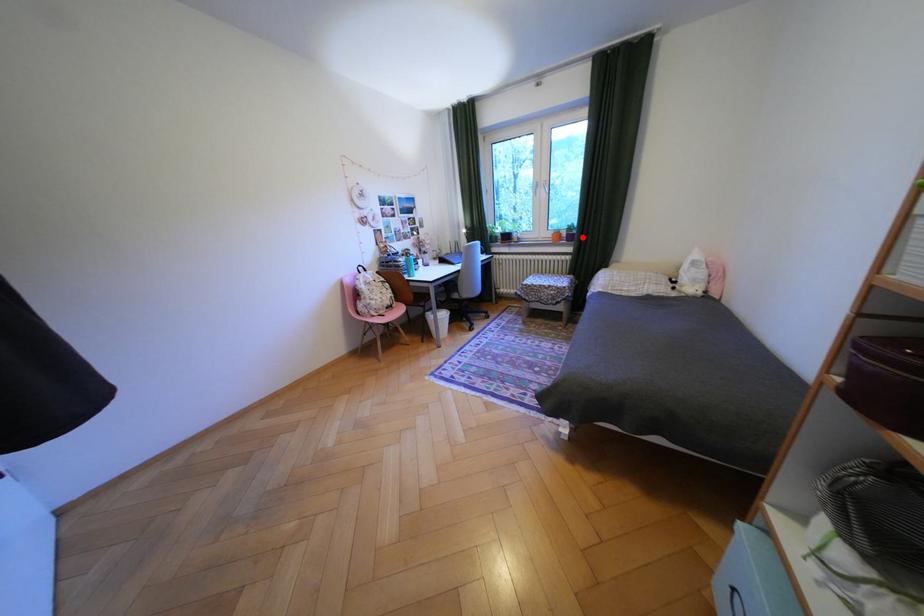
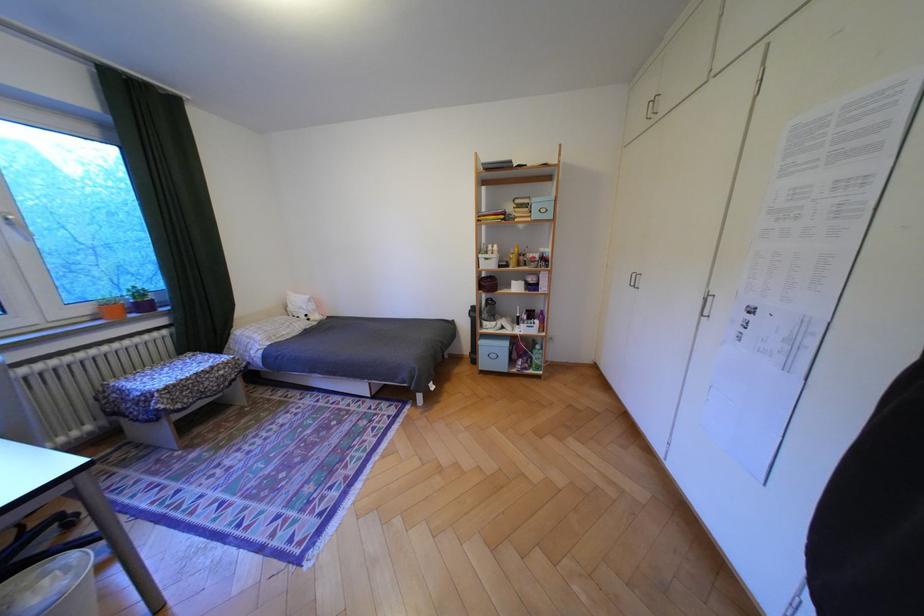
Question: I am providing you with two images of the same scene from different viewpoints. A red point is marked on the first image. At the location where the point appears in image 1, is it still visible in image 2?

Choices:
 (A) Yes
 (B) No

Answer: (A)